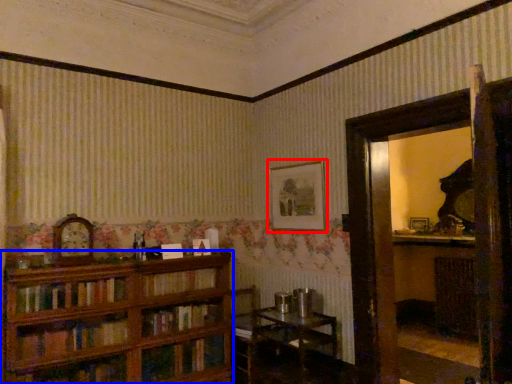
Question: Which point is further to the camera, picture frame (highlighted by a red box) or bookcase (highlighted by a blue box)?

Choices:
 (A) picture frame
 (B) bookcase

Answer: (A)